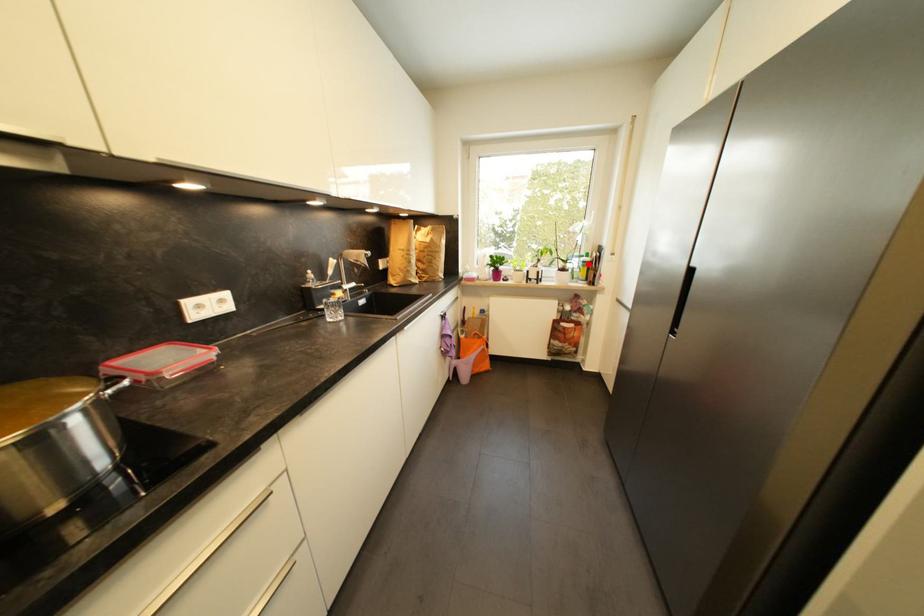
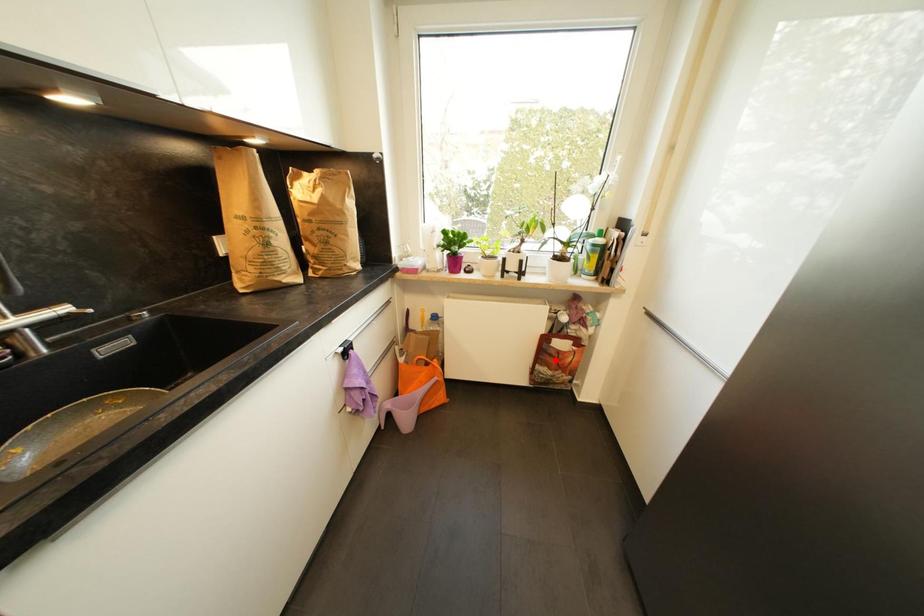
Based on the photo, I am providing you with two images of the same scene from different viewpoints. A red point is marked on the first image and another point is marked on the second image. Is the red point in image1 aligned with the point shown in image2?

No